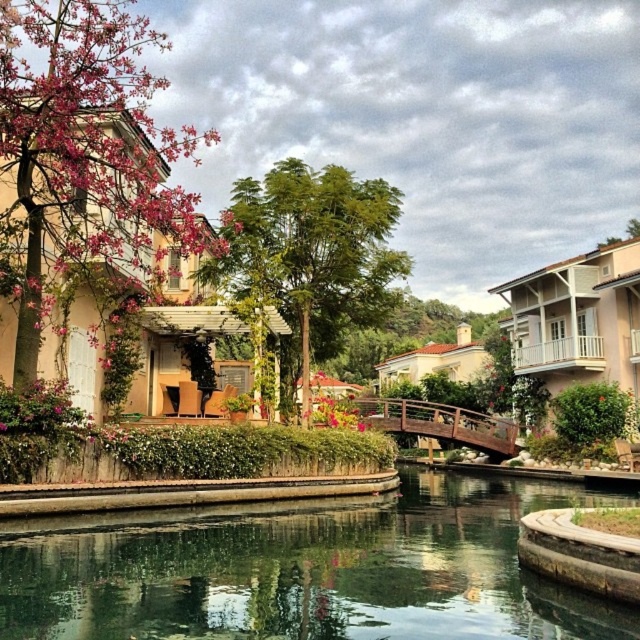
Question: Is clear glass water at center above pink blossoms at left?

Choices:
 (A) no
 (B) yes

Answer: (A)

Question: Considering the real-world distances, which object is closest to the green leafy tree at center?

Choices:
 (A) pink blossoms at left
 (B) clear glass water at center

Answer: (A)

Question: Considering the real-world distances, which object is closest to the green leafy tree at center?

Choices:
 (A) clear glass water at center
 (B) pink blossoms at left

Answer: (B)

Question: Which point is closer to the camera taking this photo?

Choices:
 (A) (291, 227)
 (B) (225, 536)

Answer: (B)

Question: Can you confirm if pink blossoms at left is thinner than green leafy tree at center?

Choices:
 (A) yes
 (B) no

Answer: (B)

Question: Can you confirm if clear glass water at center is smaller than green leafy tree at center?

Choices:
 (A) no
 (B) yes

Answer: (B)